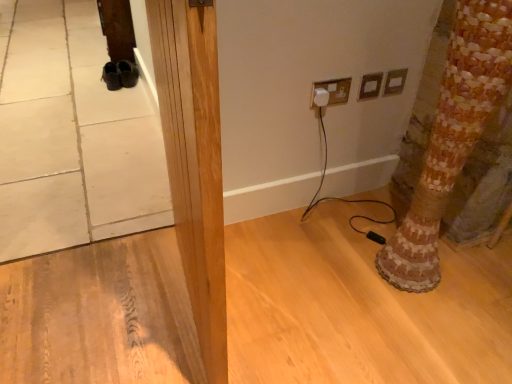
Find the location of a particular element. free space in front of wooden mosaic tree trunk at lower right is located at coordinates (429, 326).